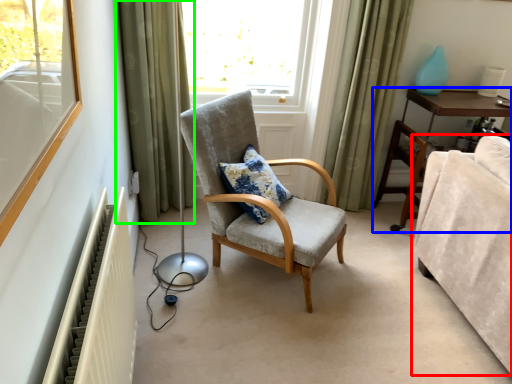
Question: Considering the real-world distances, which object is farthest from studio couch (highlighted by a red box)? dresser (highlighted by a blue box) or curtain (highlighted by a green box)?

Choices:
 (A) dresser
 (B) curtain

Answer: (B)